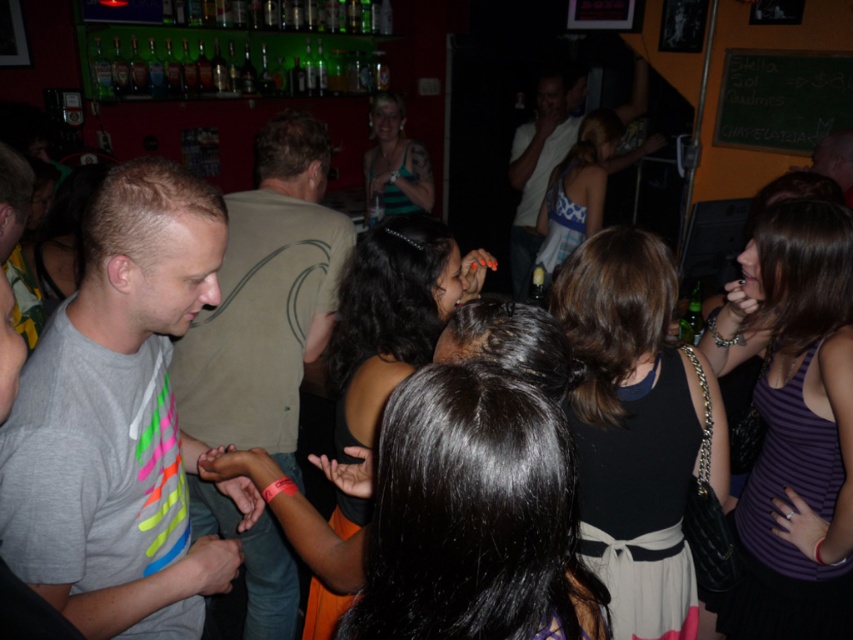
Is gray cotton t-shirt at left wider than white matte shirt at center?

No.

This screenshot has height=640, width=853. Describe the element at coordinates (119, 419) in the screenshot. I see `gray cotton t-shirt at left` at that location.

Which is behind, point (135, 342) or point (526, 256)?

Point (526, 256)

Where is `gray cotton t-shirt at left`? This screenshot has width=853, height=640. gray cotton t-shirt at left is located at coordinates (119, 419).

Looking at this image, who is shorter, gray matte t-shirt at left or white matte shirt at center?

white matte shirt at center

Between gray matte t-shirt at left and white matte shirt at center, which one is positioned lower?

gray matte t-shirt at left

Between point (302, 120) and point (526, 280), which one is positioned in front?

Positioned in front is point (302, 120).

The height and width of the screenshot is (640, 853). Identify the location of gray matte t-shirt at left. (265, 298).

Who is more forward, (148, 589) or (195, 356)?

Point (148, 589)

Between point (207, 214) and point (292, 289), which one is positioned behind?

The point (292, 289) is more distant.

Locate an element on the screen. This screenshot has width=853, height=640. gray cotton t-shirt at left is located at coordinates (119, 419).